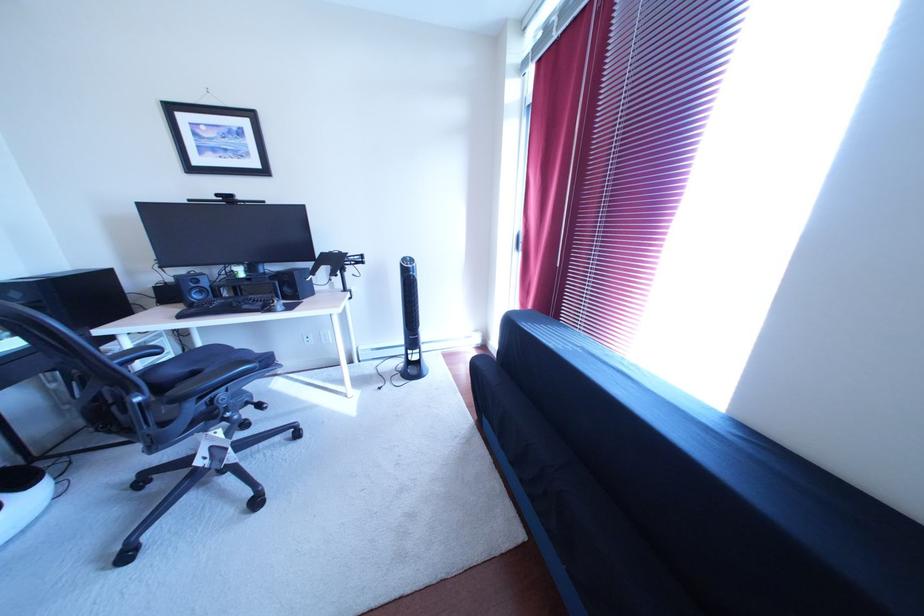
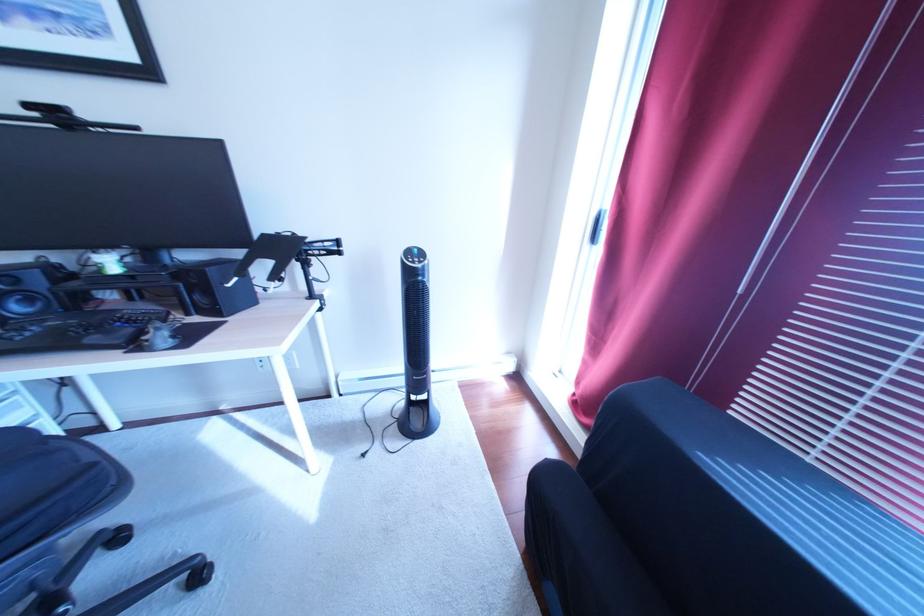
Question: In a continuous first-person perspective shot, in which direction is the camera moving?

Choices:
 (A) Left
 (B) Right
 (C) Forward
 (D) Backward

Answer: (C)